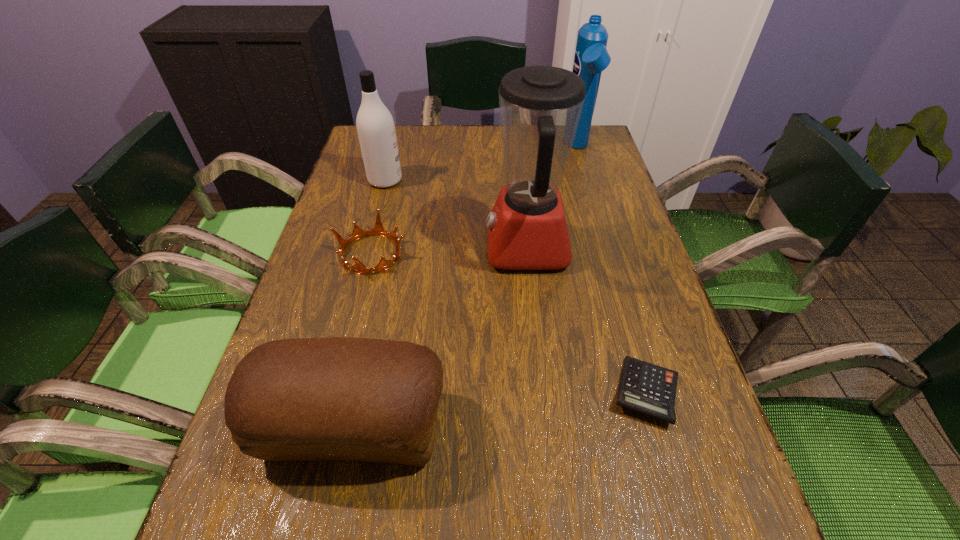
You are a GUI agent. You are given a task and a screenshot of the screen. Output one action in this format:
    pyautogui.click(x=<x>, y=<y>)
    Task: Click on the free space between the farthest object and the bread
    The width and height of the screenshot is (960, 540).
    Given the screenshot: What is the action you would take?
    pyautogui.click(x=466, y=287)

Find the location of `free area in between the fifth tallest object and the calculator`. free area in between the fifth tallest object and the calculator is located at coordinates (509, 323).

Image resolution: width=960 pixels, height=540 pixels. I want to click on blank region between the blender and the bread, so (441, 338).

Find the location of a particular element. The image size is (960, 540). vacant space in between the shortest object and the shorter shampoo is located at coordinates (516, 286).

The height and width of the screenshot is (540, 960). I want to click on empty space between the calculator and the blender, so click(587, 320).

Locate an element on the screen. Image resolution: width=960 pixels, height=540 pixels. unoccupied position between the farthest object and the calculator is located at coordinates (612, 270).

Identify the location of free spot between the bread and the farthest object. (466, 287).

Where is `object that is the third closest to the taller shampoo`? This screenshot has width=960, height=540. object that is the third closest to the taller shampoo is located at coordinates (378, 230).

Locate which object is the fourth closest to the blender. Please provide its 2D coordinates. Your answer should be formatted as a tuple, i.e. [(x, y)], where the tuple contains the x and y coordinates of a point satisfying the conditions above.

[(339, 398)]

Find the location of a particular element. The image size is (960, 540). vacant space that satisfies the following two spatial constraints: 1. on the front of the fourth object from left to right near the controls; 2. on the left side of the shortest object is located at coordinates (542, 393).